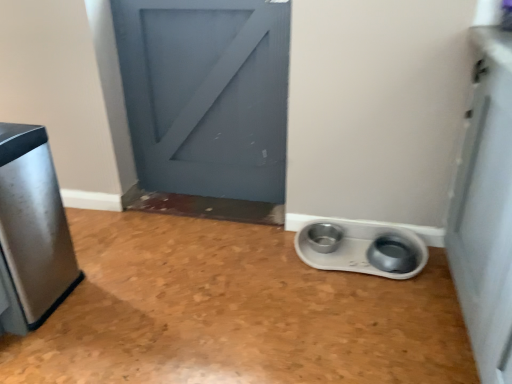
Identify the location of vacant area located to the right-hand side of brushed metal trash can at left. (106, 293).